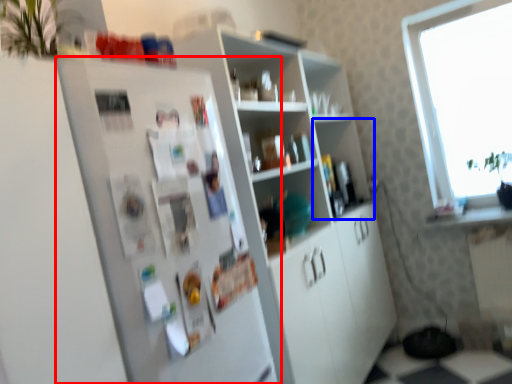
Question: Which of the following is the farthest to the observer, fridge (highlighted by a red box) or shelf (highlighted by a blue box)?

Choices:
 (A) fridge
 (B) shelf

Answer: (B)